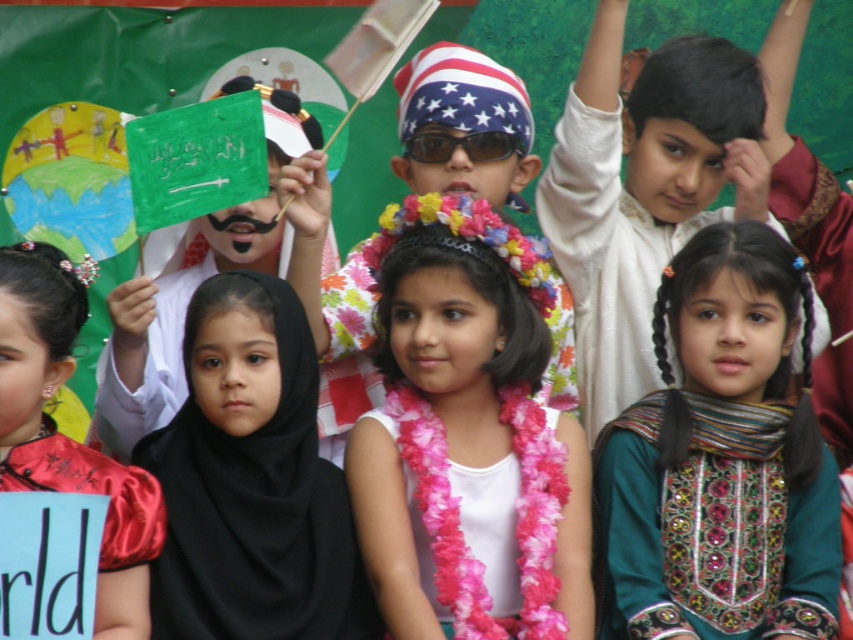
Can you confirm if pink fabric lei at center is bigger than black fabric hijab at center?

No, pink fabric lei at center is not bigger than black fabric hijab at center.

Does pink fabric lei at center have a lesser height compared to black fabric hijab at center?

Yes, pink fabric lei at center is shorter than black fabric hijab at center.

The height and width of the screenshot is (640, 853). Identify the location of pink fabric lei at center. (467, 435).

Does point (198, 342) come in front of point (36, 454)?

That is False.

Is black fabric hijab at center positioned before red satin dress at left?

No, it is behind red satin dress at left.

Which is in front, point (238, 554) or point (148, 593)?

Point (148, 593) is in front.

Where is `black fabric hijab at center`? This screenshot has height=640, width=853. black fabric hijab at center is located at coordinates (252, 484).

Does pink fabric lei at center appear over reflective plastic sunglasses at center?

Incorrect, pink fabric lei at center is not positioned above reflective plastic sunglasses at center.

Between point (532, 308) and point (474, 148), which one is positioned behind?

The point (474, 148) is more distant.

Locate an element on the screen. pink fabric lei at center is located at coordinates (467, 435).